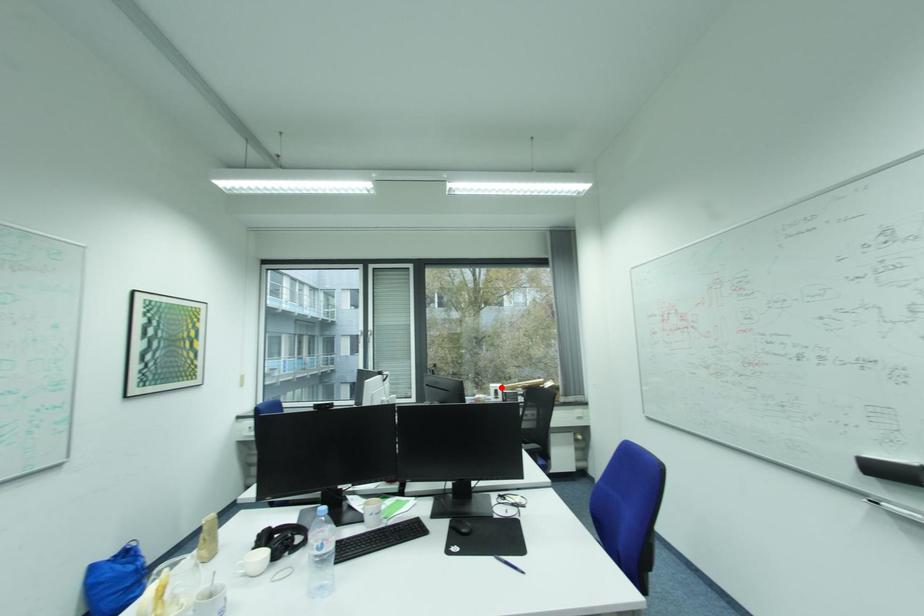
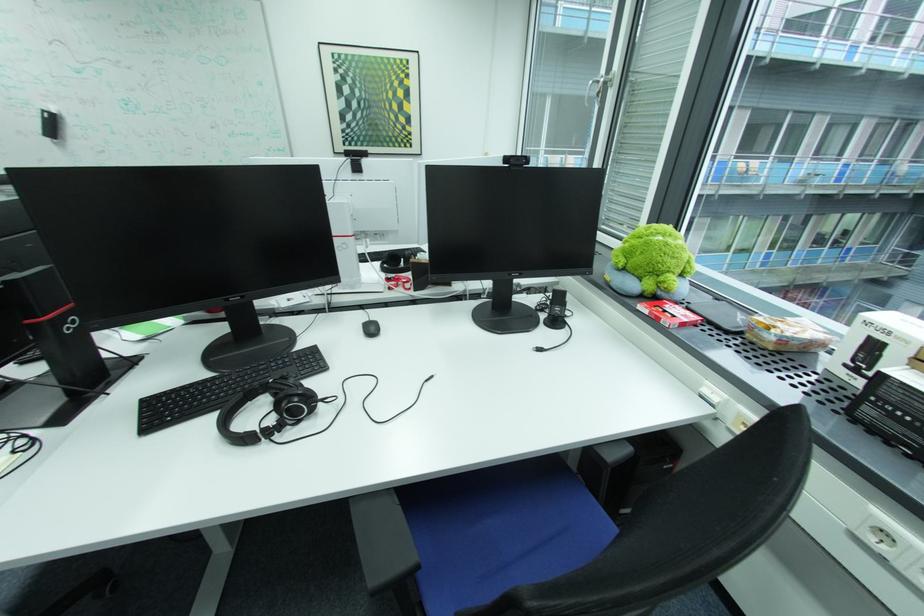
In the second image, find the point that corresponds to the highlighted location in the first image.

(876, 323)